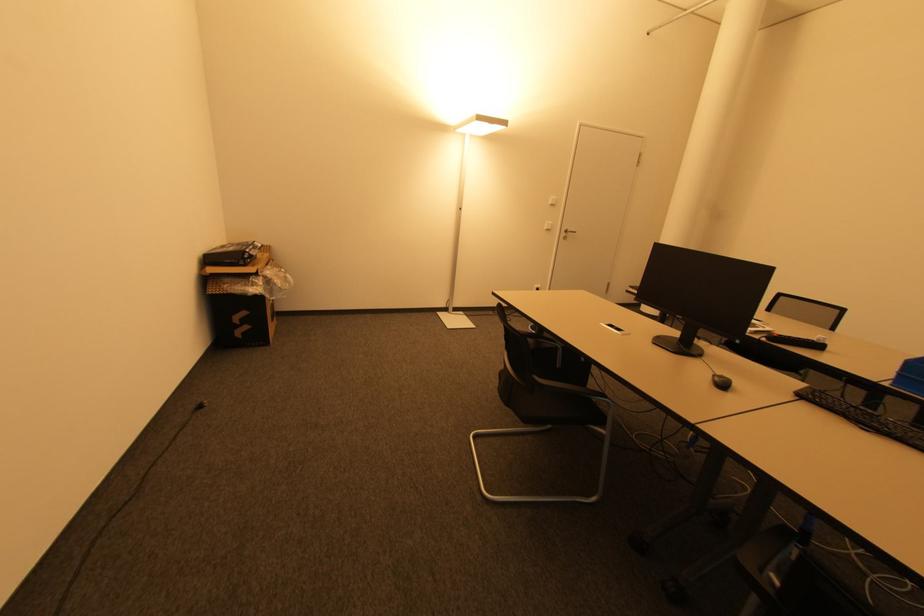
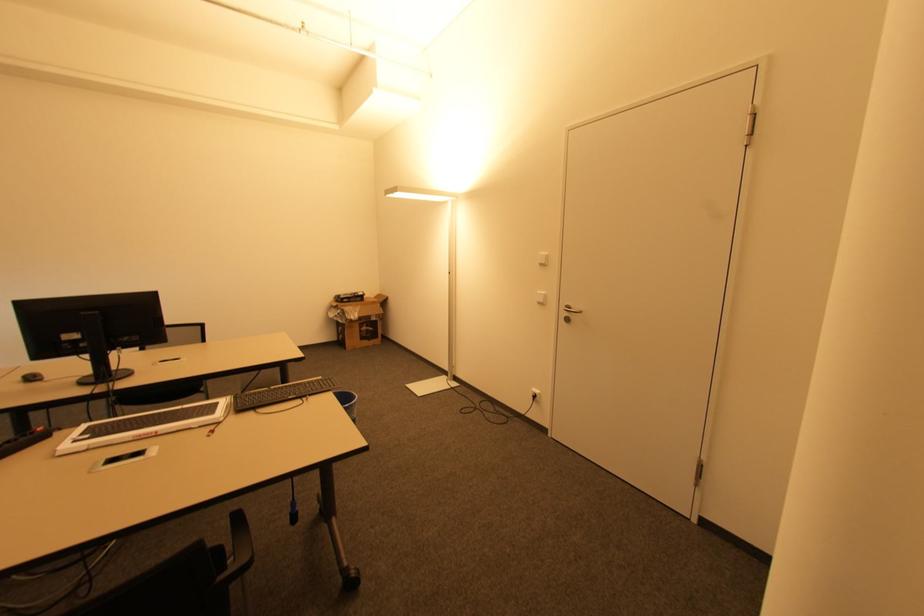
In the second image, find the point that corresponds to (566,238) in the first image.

(568, 320)